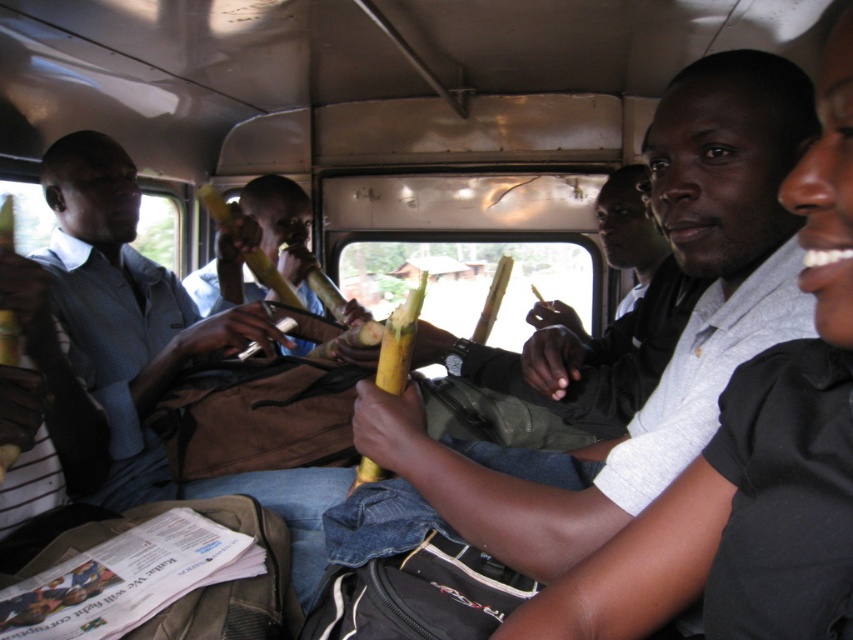
Can you confirm if smooth yellow banana at center is thinner than matte blue shirt at center?

Correct, smooth yellow banana at center's width is less than matte blue shirt at center's.

Does smooth yellow banana at center have a greater height compared to matte blue shirt at center?

A: In fact, smooth yellow banana at center may be shorter than matte blue shirt at center.

Who is more distant from viewer, (x=352, y=564) or (x=85, y=257)?

Point (x=85, y=257)

This screenshot has width=853, height=640. Find the location of `smooth yellow banana at center`. smooth yellow banana at center is located at coordinates (631, 413).

Who is more distant from viewer, (598, 518) or (306, 228)?

Point (306, 228)

Based on the photo, between smooth yellow banana at center and smooth brown banana at center, which one appears on the left side from the viewer's perspective?

Positioned to the left is smooth brown banana at center.

Which is behind, point (340, 584) or point (242, 298)?

Positioned behind is point (242, 298).

The image size is (853, 640). Find the location of `smooth yellow banana at center`. smooth yellow banana at center is located at coordinates (x=631, y=413).

Does matte blue shirt at center appear under smooth brown banana at center?

Yes, matte blue shirt at center is below smooth brown banana at center.

Who is more forward, (125,192) or (202,314)?

Positioned in front is point (125,192).

Who is more distant from viewer, (131, 276) or (194, 301)?

Point (194, 301)

Where is `matte blue shirt at center`? The width and height of the screenshot is (853, 640). matte blue shirt at center is located at coordinates (154, 346).